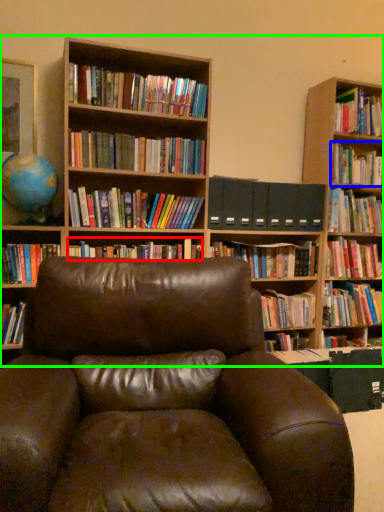
Question: Considering the real-world distances, which object is farthest from book (highlighted by a red box)? book (highlighted by a blue box) or bookcase (highlighted by a green box)?

Choices:
 (A) book
 (B) bookcase

Answer: (A)